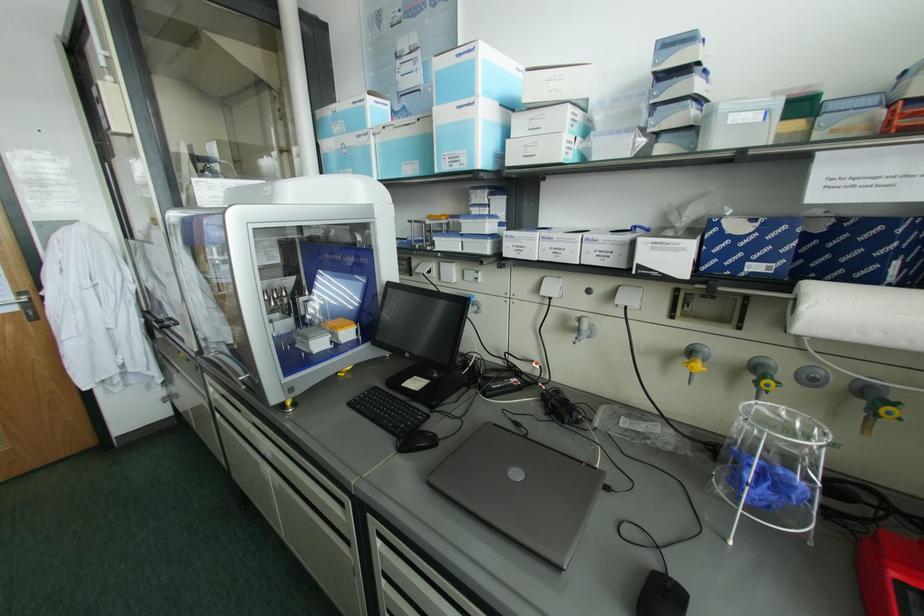
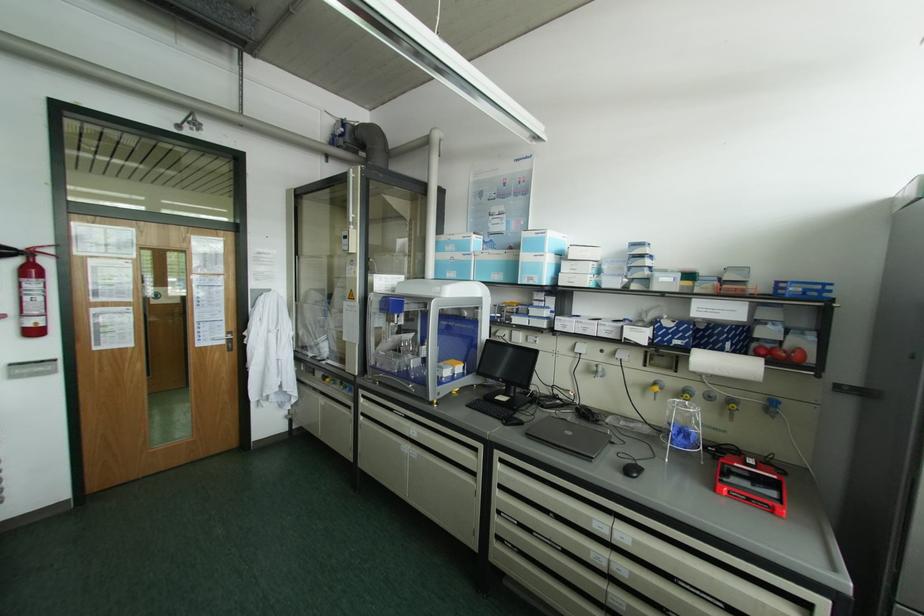
In the second image, find the point that corresponds to [319,344] in the first image.

(445, 371)